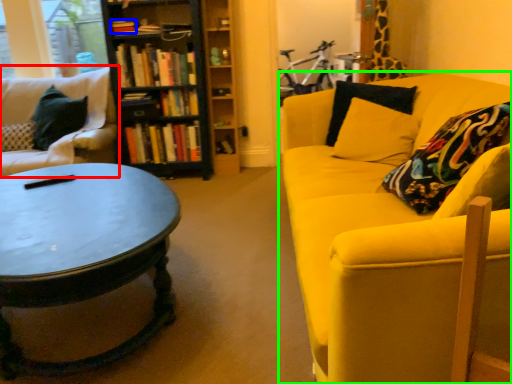
Question: Based on their relative distances, which object is farther from studio couch (highlighted by a red box)? Choose from book (highlighted by a blue box) and studio couch (highlighted by a green box).

Choices:
 (A) book
 (B) studio couch

Answer: (B)